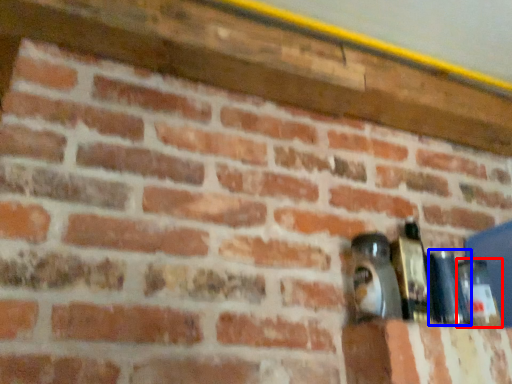
Question: Which of the following is the closest to the observer, bottle (highlighted by a red box) or bottle (highlighted by a blue box)?

Choices:
 (A) bottle
 (B) bottle

Answer: (B)